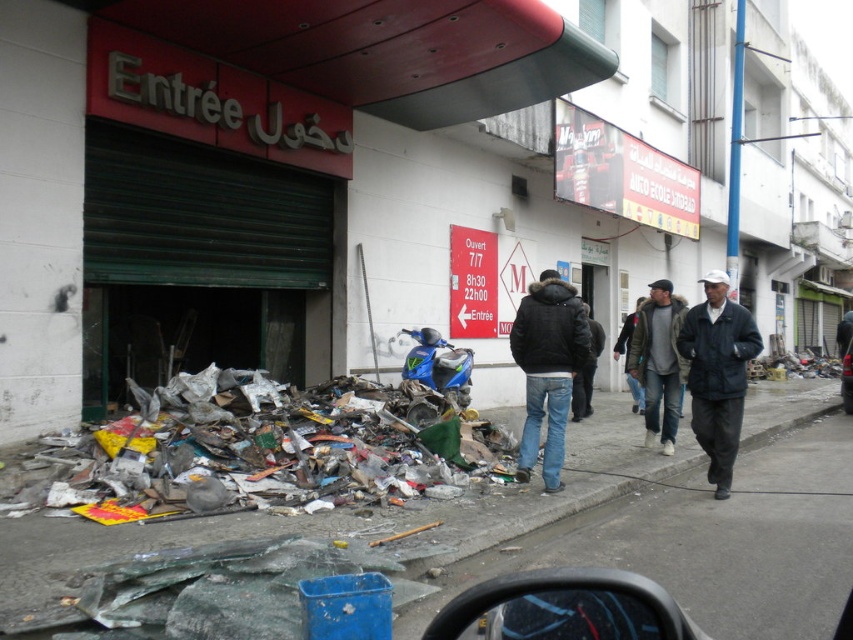
You are a delivery person arriving at this location and need to park your bike. The bike stand is located at the broken glass pavement at lower left. However, there is a dark blue jacket at right nearby. Can you park your bike there without the jacket blocking the stand?

The broken glass pavement at lower left is bigger than the dark blue jacket at right, so there should be enough space to park the bike without the jacket blocking the stand.

You are a delivery person trying to choose a jacket to protect yourself from the rain. You see a black matte jacket at center and a dark gray jacket at right. Which jacket would be more suitable based on their thickness?

The dark gray jacket at right is thicker than the black matte jacket at center, so it would be more suitable for protection from the rain.